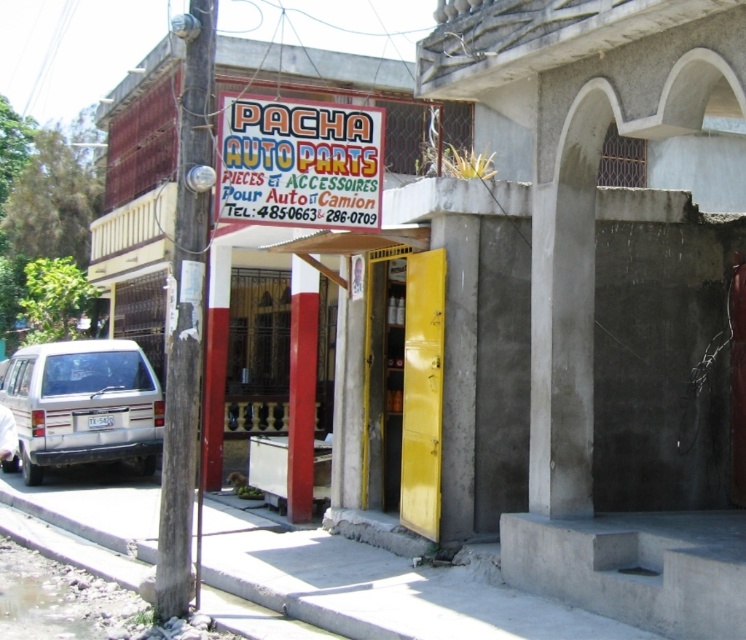
Is bright yellow signboard at upper center wider than white matte suv at lower left?

No.

Is bright yellow signboard at upper center to the left of white matte suv at lower left from the viewer's perspective?

No, bright yellow signboard at upper center is not to the left of white matte suv at lower left.

Between point (325, 227) and point (25, 403), which one is positioned in front?

Point (325, 227)

You are a GUI agent. You are given a task and a screenshot of the screen. Output one action in this format:
    pyautogui.click(x=<x>, y=<y>)
    Task: Click on the bright yellow signboard at upper center
    This screenshot has width=746, height=640.
    Given the screenshot: What is the action you would take?
    pyautogui.click(x=298, y=163)